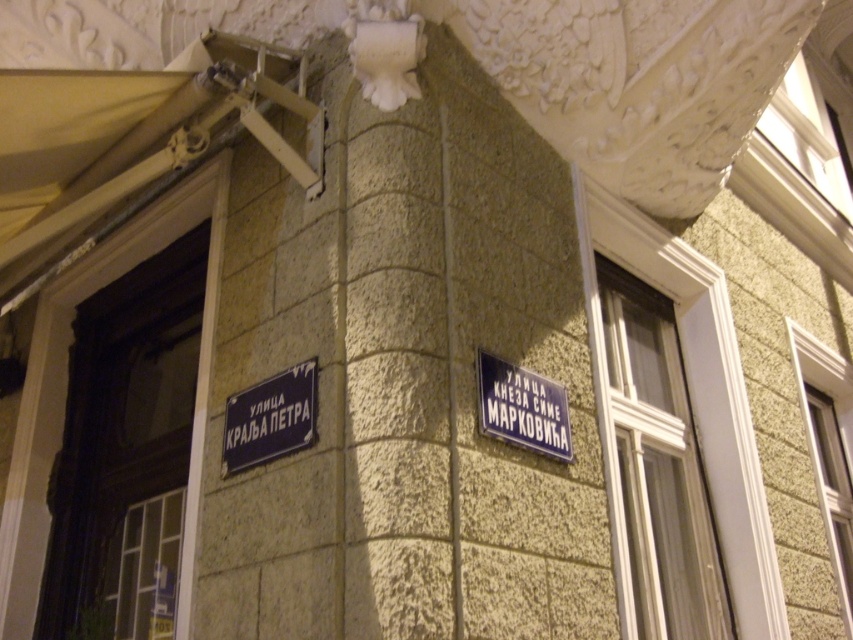
You are standing in front of the building and want to read the dark blue metal street sign at lower left. Is it within a comfortable reading distance of 2 meters?

The dark blue metal street sign at lower left is 1.93 meters away from the viewer, which is within the comfortable reading distance of 2 meters.

You are a pedestrian trying to read both street signs on the building corner. Which sign can you read more easily, the dark blue metal street sign at lower left or the blue metallic sign at upper right?

The dark blue metal street sign at lower left is taller than the blue metallic sign at upper right, so it is larger and more legible from a distance, making it easier to read.

Consider the image. You are a city planner measuring the spacing between two street signs on a building wall. The dark blue metal street sign at lower left and the blue metallic sign at upper right are both part of a new design. According to the city ordinance, the minimum spacing between two signs must be at least 60 centimeters. Does the current spacing between these two signs meet the requirement?

The distance between the dark blue metal street sign at lower left and the blue metallic sign at upper right is 59.58 centimeters, which is less than the required 60 centimeters. Therefore, the current spacing does not meet the city ordinance requirement.